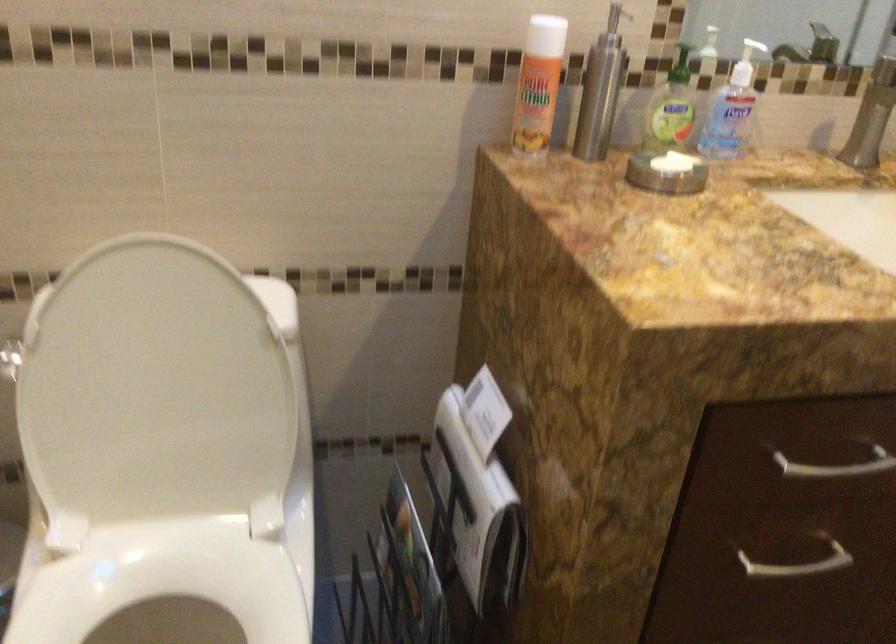
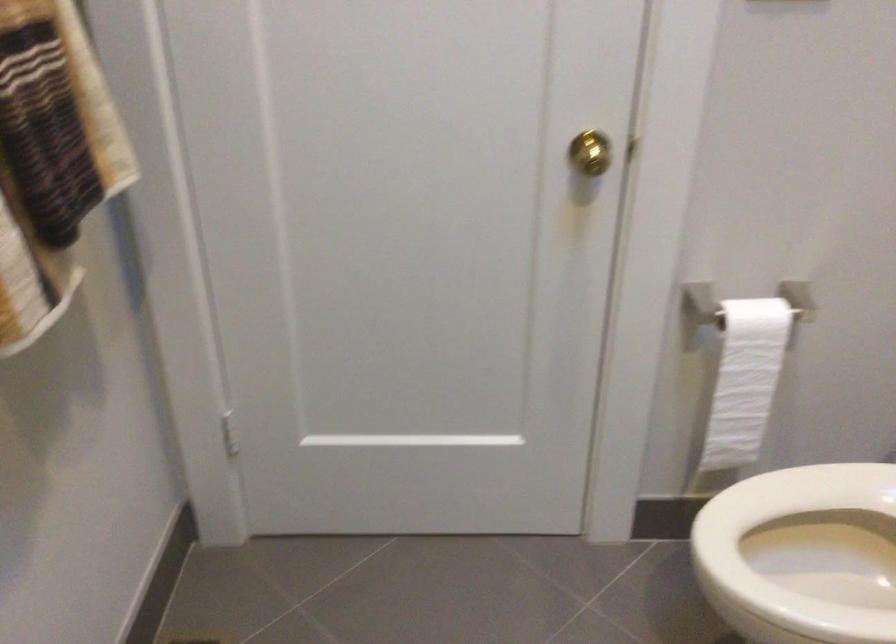
First-person continuous shooting, in which direction is the camera rotating?

The rotation direction of the camera is left-down.